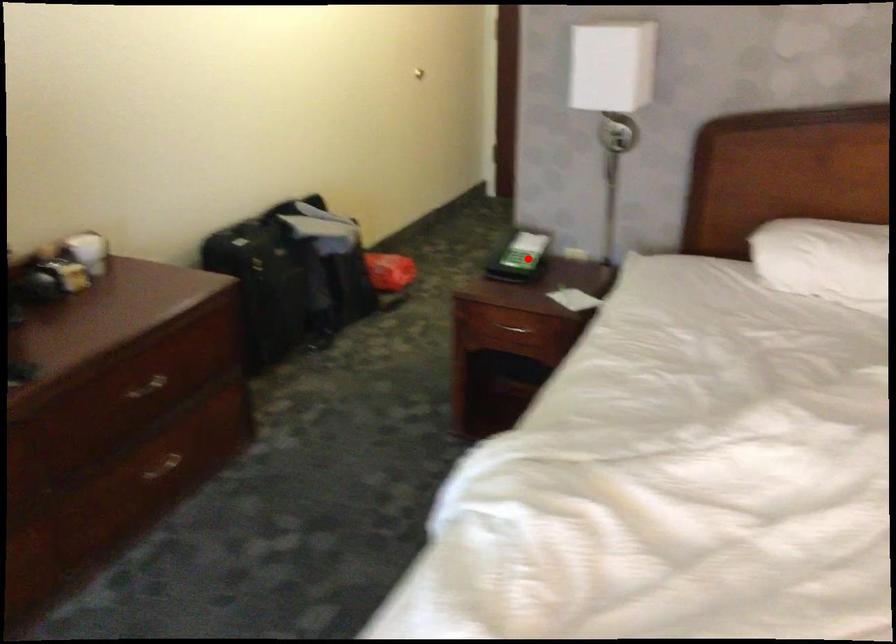
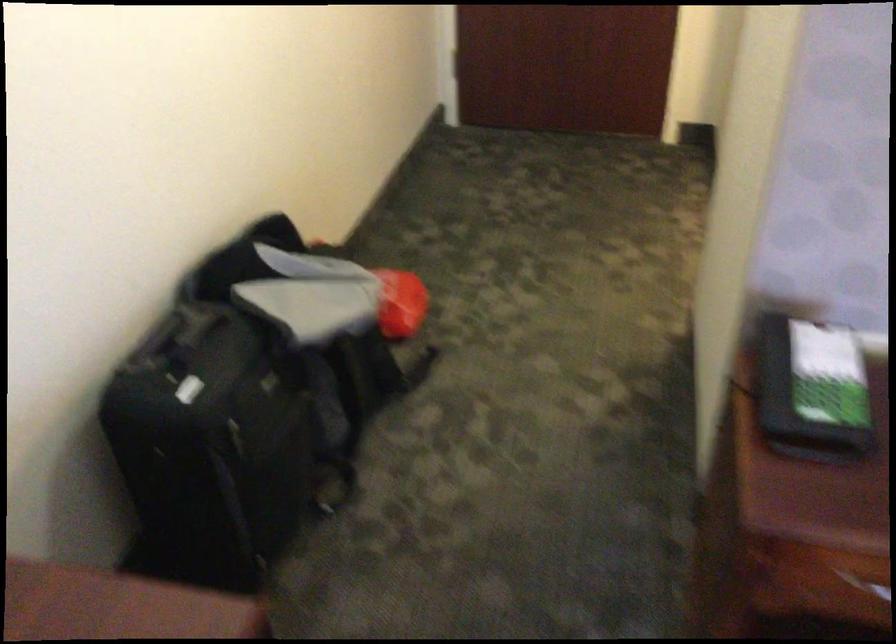
Where in the second image is the point corresponding to the highlighted location from the first image?

(812, 390)